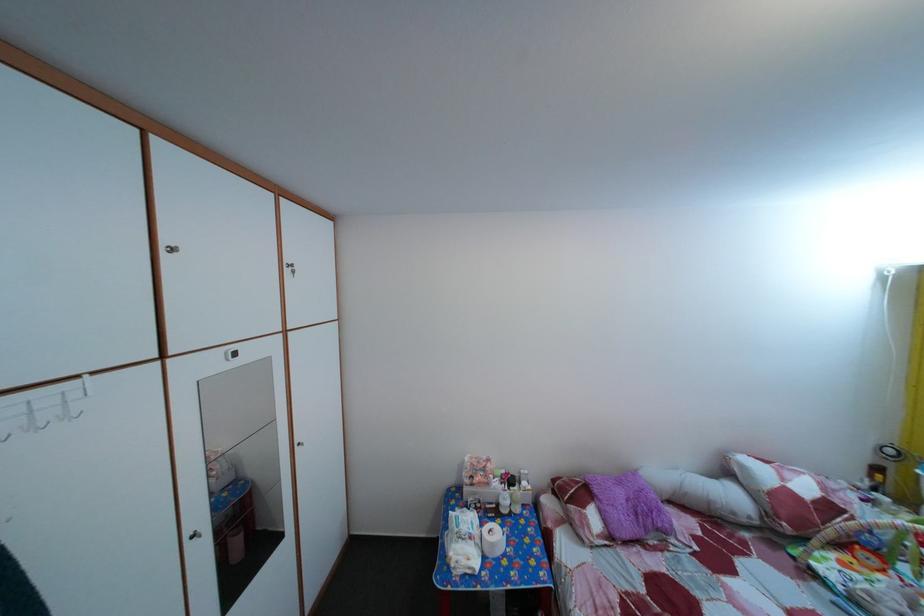
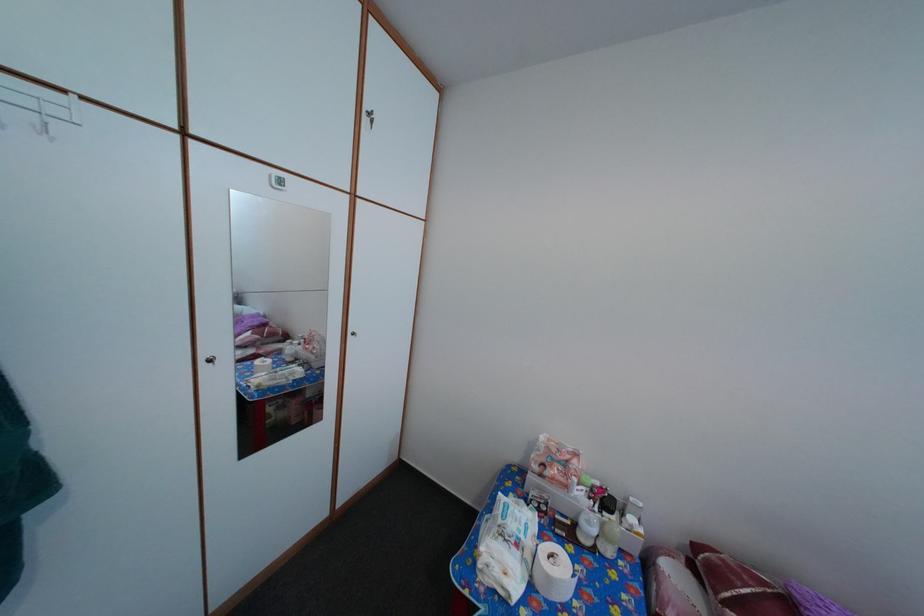
Locate, in the second image, the point that corresponds to point (563, 488) in the first image.

(704, 554)